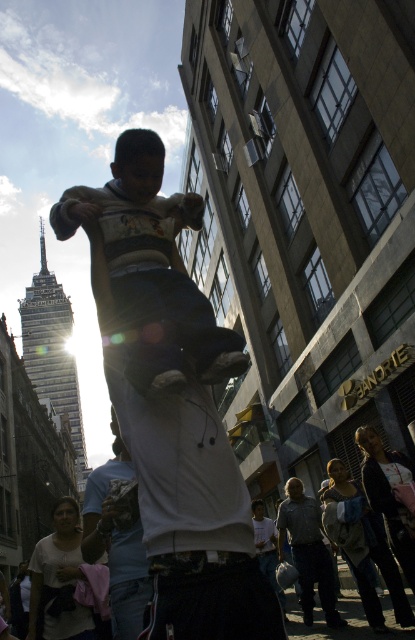
Is white cotton shirt at center bigger than white fabric at lower left?

Yes.

Can you confirm if white cotton shirt at center is positioned to the left of white fabric at lower left?

Incorrect, white cotton shirt at center is not on the left side of white fabric at lower left.

Identify the location of white cotton shirt at center. Image resolution: width=415 pixels, height=640 pixels. (117, 544).

Looking at this image, who is more distant from viewer, (138, 312) or (288, 525)?

Positioned behind is point (288, 525).

Between matte white shirt at center and gray textured shirt at center, which one has less height?

With less height is gray textured shirt at center.

This screenshot has width=415, height=640. I want to click on matte white shirt at center, so click(x=151, y=268).

Who is higher up, white cotton shirt at center or gray textured shirt at center?

white cotton shirt at center is above.

Who is positioned more to the left, white cotton shirt at center or gray textured shirt at center?

From the viewer's perspective, white cotton shirt at center appears more on the left side.

Does point (116, 561) come closer to viewer compared to point (295, 492)?

Yes.

The height and width of the screenshot is (640, 415). I want to click on white cotton shirt at center, so click(117, 544).